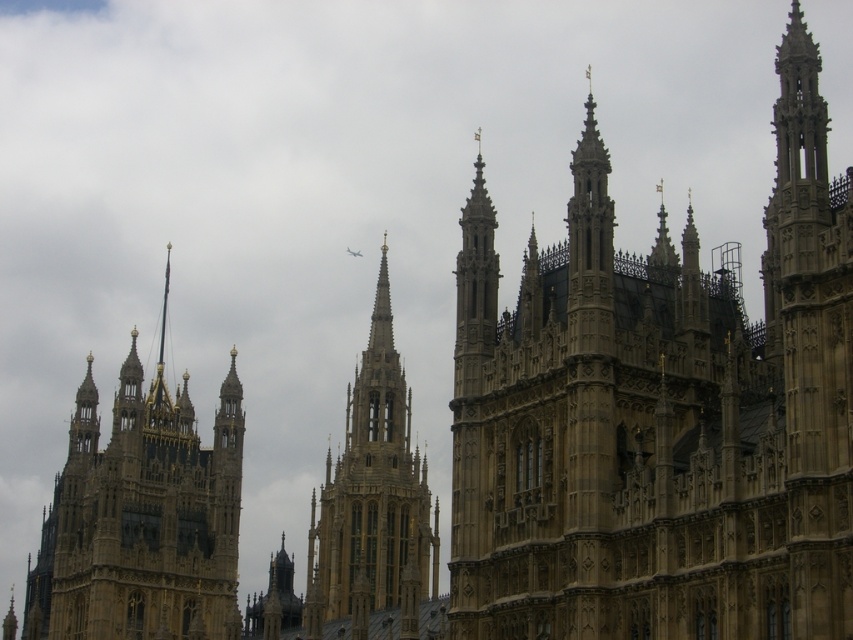
Based on the photo, does golden stone tower at center appear over golden stone spire at left?

Indeed, golden stone tower at center is positioned over golden stone spire at left.

Does golden stone tower at center lie in front of golden stone spire at left?

Yes.

Describe the element at coordinates (605, 435) in the screenshot. I see `golden stone tower at center` at that location.

Where is `golden stone tower at center`? This screenshot has height=640, width=853. golden stone tower at center is located at coordinates (605, 435).

Can you confirm if golden stone spire at left is wider than golden stone spire at center?

Yes.

Who is more forward, (57, 556) or (350, 516)?

Point (350, 516) is in front.

The width and height of the screenshot is (853, 640). Describe the element at coordinates (142, 516) in the screenshot. I see `golden stone spire at left` at that location.

This screenshot has width=853, height=640. I want to click on golden stone spire at left, so click(x=142, y=516).

Can you confirm if golden stone tower at center is positioned below golden stone spire at center?

Incorrect, golden stone tower at center is not positioned below golden stone spire at center.

Who is lower down, golden stone tower at center or golden stone spire at center?

golden stone spire at center is below.

Identify the location of golden stone tower at center. (605, 435).